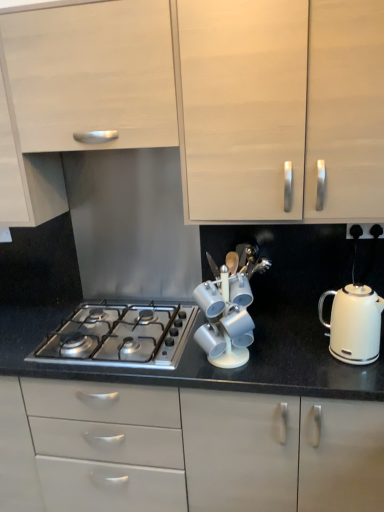
Identify the location of vacant space in white matte cabinet at upper center, which is counted as the third cabinetry, starting from the top (from a real-world perspective). (288, 325).